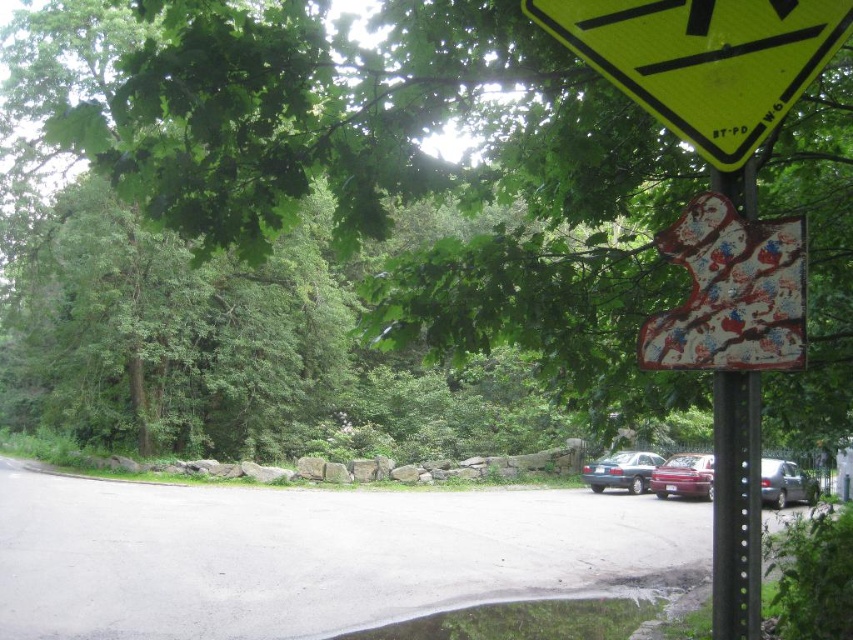
Question: Which point appears closest to the camera in this image?

Choices:
 (A) pyautogui.click(x=764, y=221)
 (B) pyautogui.click(x=184, y=134)
 (C) pyautogui.click(x=756, y=563)

Answer: (C)

Question: Among these points, which one is nearest to the camera?

Choices:
 (A) (746, 253)
 (B) (671, 492)

Answer: (A)

Question: Which object is closer to the camera taking this photo?

Choices:
 (A) green matte puddle at lower center
 (B) green leafy tree at upper center

Answer: (B)

Question: Is green leafy tree at upper center to the right of black metal signpost at right from the viewer's perspective?

Choices:
 (A) yes
 (B) no

Answer: (B)

Question: Is yellow reflective plastic triangle at upper right thinner than painted wooden sign at upper right?

Choices:
 (A) yes
 (B) no

Answer: (B)

Question: Does green matte puddle at lower center appear on the left side of matte blue sedan at center?

Choices:
 (A) yes
 (B) no

Answer: (A)